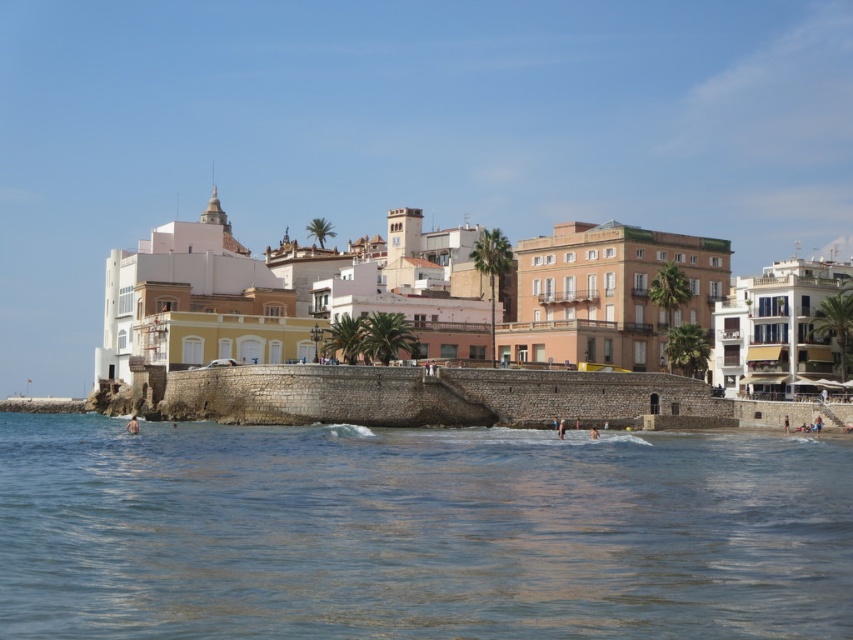
Is clear blue water at lower center positioned before yellow stucco buildings at center?

Yes, it is.

Is clear blue water at lower center positioned behind yellow stucco buildings at center?

No.

At what (x,y) coordinates should I click in order to perform the action: click on clear blue water at lower center. Please return your answer as a coordinate pair (x, y). This screenshot has height=640, width=853. Looking at the image, I should click on (418, 532).